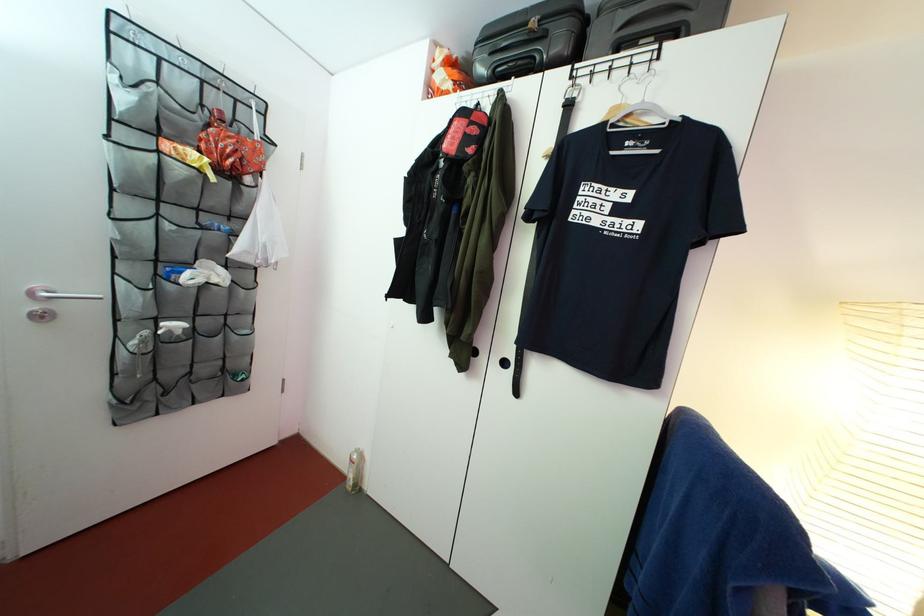
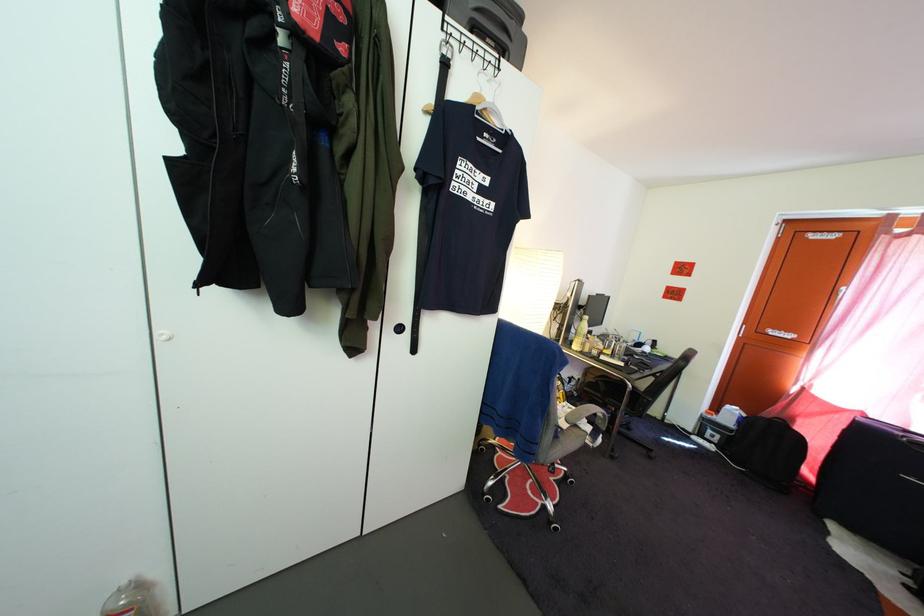
Based on the continuous images, in which direction is the camera rotating?

The camera's rotation is toward right-down.